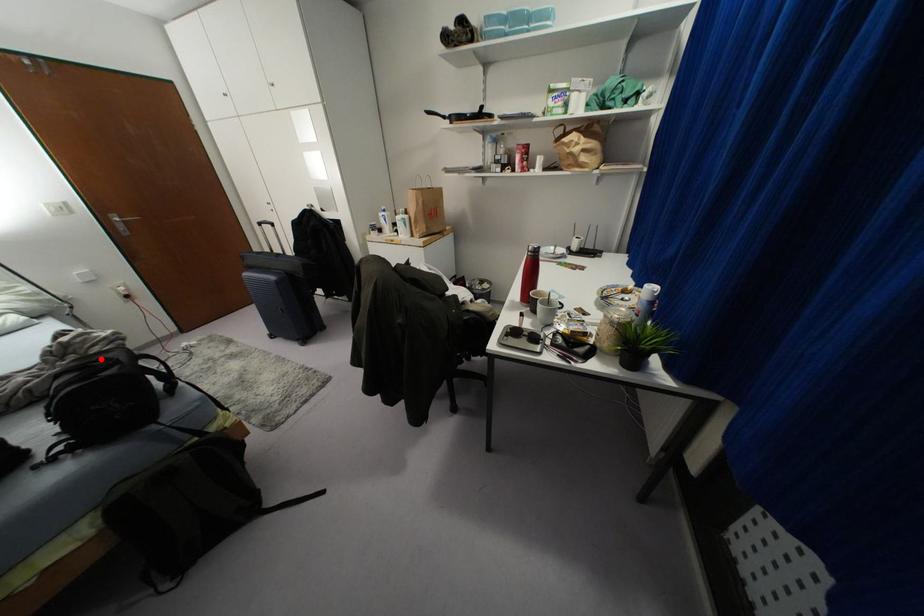
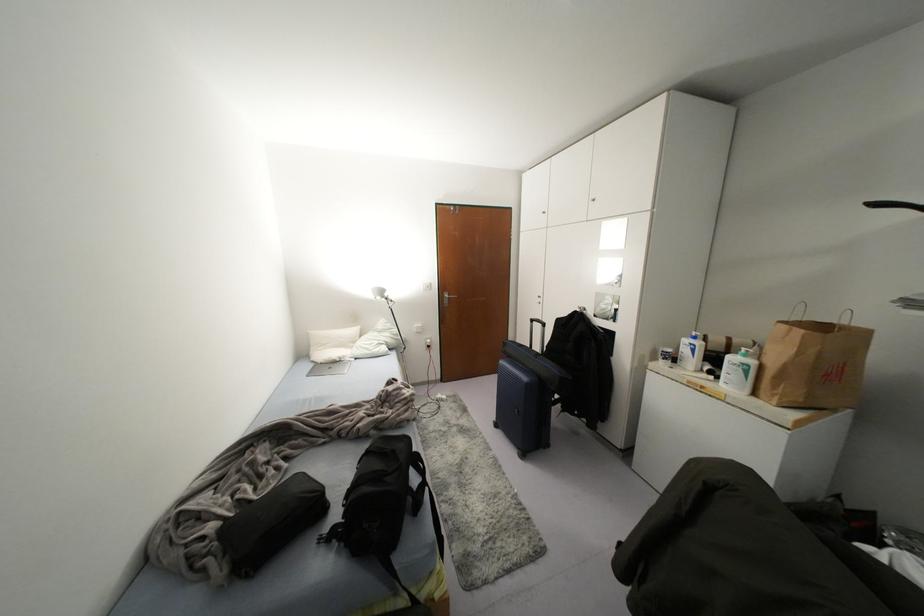
Locate, in the second image, the point that corresponds to the highlighted location in the first image.

(393, 451)